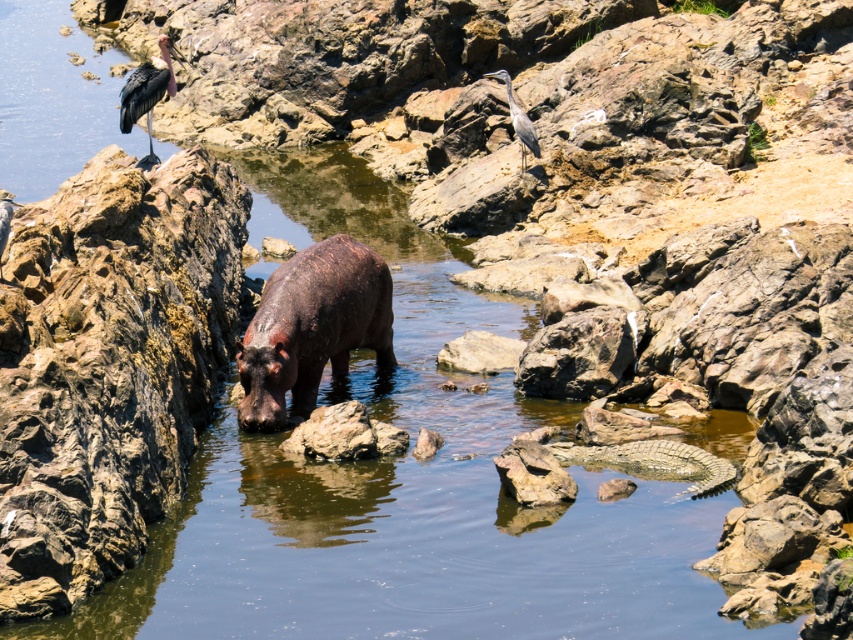
Does dark brown textured hippo at center have a greater width compared to smooth gray rock at center?

Indeed, dark brown textured hippo at center has a greater width compared to smooth gray rock at center.

Does dark brown textured hippo at center have a greater height compared to smooth gray rock at center?

Yes.

Locate an element on the screen. dark brown textured hippo at center is located at coordinates click(x=312, y=326).

Is gray matte heron at upper center to the left of smooth gray heron at upper center from the viewer's perspective?

No, gray matte heron at upper center is not to the left of smooth gray heron at upper center.

Between point (527, 124) and point (0, 195), which one is positioned behind?

Point (527, 124)

What are the coordinates of `gray matte heron at upper center` in the screenshot? It's located at (518, 120).

Is dark brown textured hippo at center positioned behind dark plumage feathered bird at upper left?

No, it is in front of dark plumage feathered bird at upper left.

Does dark brown textured hippo at center appear over dark plumage feathered bird at upper left?

Incorrect, dark brown textured hippo at center is not positioned above dark plumage feathered bird at upper left.

What do you see at coordinates (312, 326) in the screenshot? I see `dark brown textured hippo at center` at bounding box center [312, 326].

I want to click on dark brown textured hippo at center, so click(x=312, y=326).